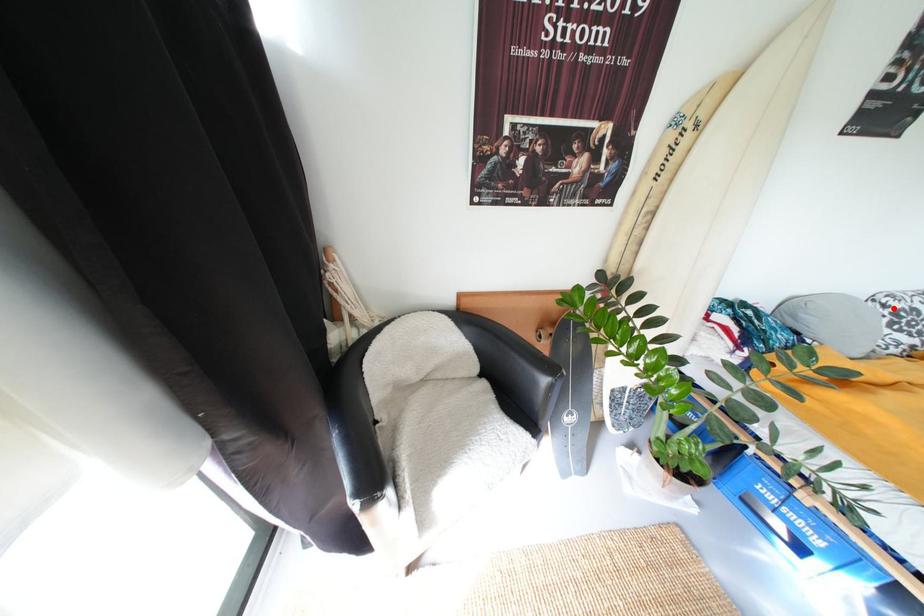
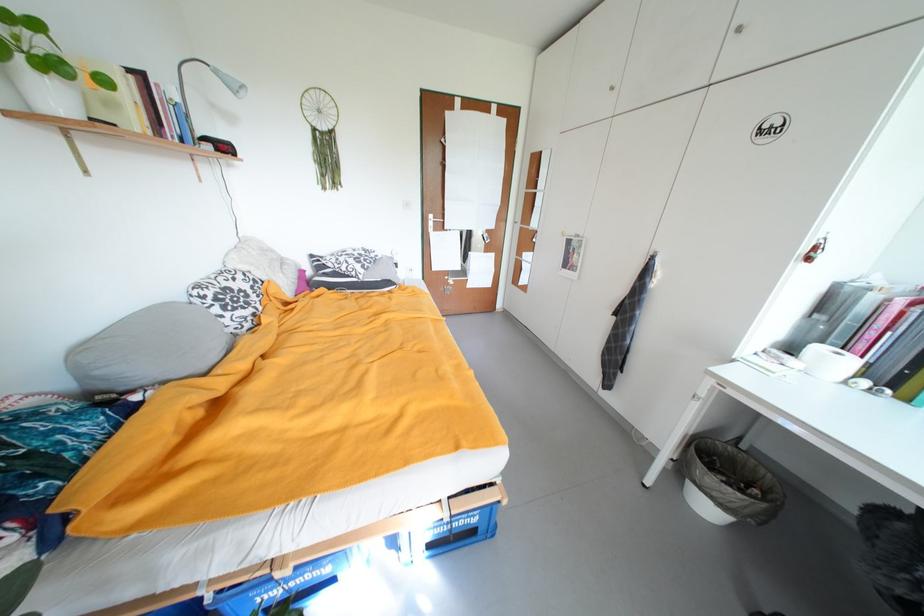
Question: I am providing you with two images of the same scene from different viewpoints. A red point is shown in image1. For the corresponding object point in image2, is it positioned nearer or farther from the camera?

Choices:
 (A) Nearer
 (B) Farther

Answer: (A)